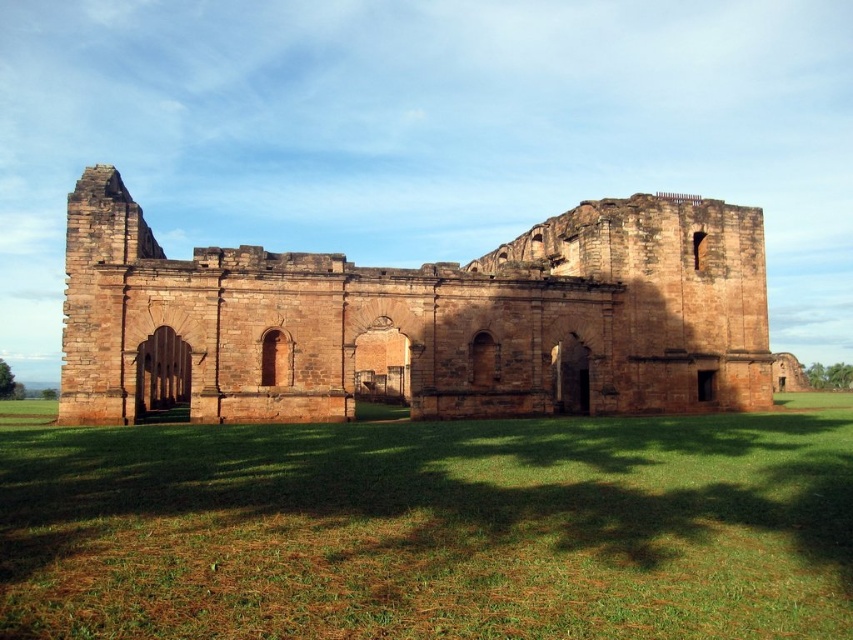
Question: From the image, what is the correct spatial relationship of green grass at center in relation to brown stone ruins at center?

Choices:
 (A) below
 (B) above

Answer: (A)

Question: Among these objects, which one is nearest to the camera?

Choices:
 (A) green grass at center
 (B) brown stone ruins at center

Answer: (A)

Question: Can you confirm if green grass at center is wider than brown stone ruins at center?

Choices:
 (A) yes
 (B) no

Answer: (A)

Question: Can you confirm if green grass at center is bigger than brown stone ruins at center?

Choices:
 (A) no
 (B) yes

Answer: (A)

Question: Which point appears closest to the camera in this image?

Choices:
 (A) (45, 500)
 (B) (68, 195)

Answer: (A)

Question: Among these objects, which one is farthest from the camera?

Choices:
 (A) brown stone ruins at center
 (B) green grass at center

Answer: (A)